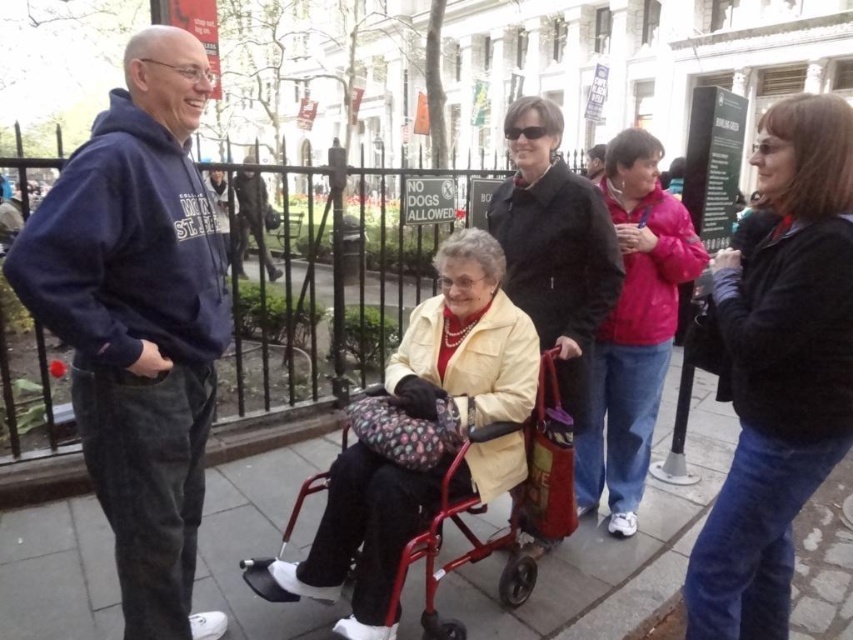
Question: Which point is closer to the camera?

Choices:
 (A) click(x=238, y=627)
 (B) click(x=641, y=401)
 (C) click(x=157, y=124)

Answer: (C)

Question: Which of these objects is positioned closest to the matte yellow jacket at center?

Choices:
 (A) black sweater at center
 (B) matte pink jacket at center
 (C) navy blue hoodie at left
 (D) black leather jacket at center

Answer: (D)

Question: Does black sweater at center have a greater width compared to matte pink jacket at center?

Choices:
 (A) no
 (B) yes

Answer: (A)

Question: Does smooth concrete sidewalk at center appear on the left side of matte pink jacket at center?

Choices:
 (A) yes
 (B) no

Answer: (A)

Question: Is navy blue hoodie at left below matte yellow jacket at center?

Choices:
 (A) yes
 (B) no

Answer: (B)

Question: Considering the real-world distances, which object is farthest from the matte yellow jacket at center?

Choices:
 (A) black sweater at center
 (B) smooth concrete sidewalk at center
 (C) navy blue hoodie at left

Answer: (A)